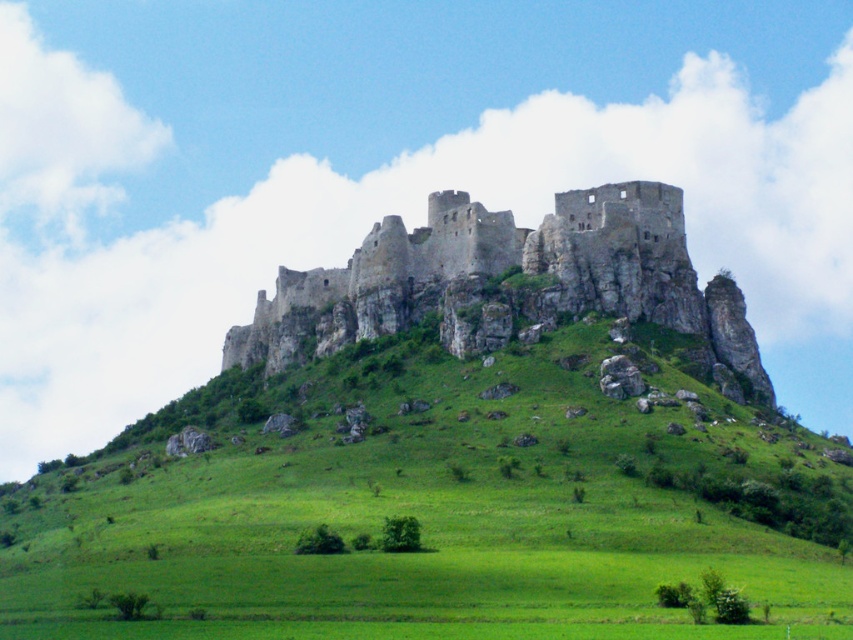
You are a medieval knight standing at the base of the castle hill. You need to reach the castle entrance located at the top of the green grassy hill at center. Based on the coordinates provided, in which direction should you move to ascend the hill?

The green grassy hill at center is located at coordinates point (439,506). Since the y coordinate is 0.516, which is above the center point of 0.5, the hill slopes upward in that direction. Therefore, you should move towards the green grassy hill at center to ascend the hill.

You are a knight standing on the green grassy hill at center. You want to reach the top of the rustic stone castle at center. Which direction should you move?

The green grassy hill at center is below the rustic stone castle at center, so you should move upward towards the rustic stone castle at center to reach its top.